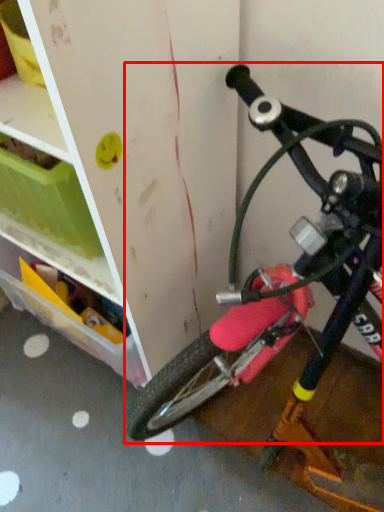
Question: Observing the image, what is the correct spatial positioning of bicycle (annotated by the red box) in reference to storage box?

Choices:
 (A) right
 (B) left

Answer: (A)